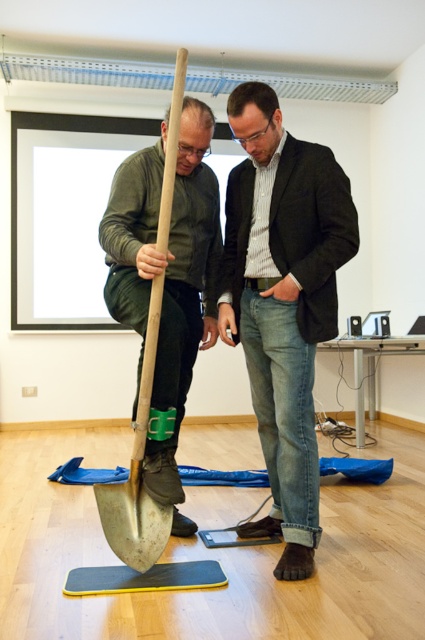
Between denim jeans at center and wooden shovel at left, which one is positioned higher?

wooden shovel at left is higher up.

The width and height of the screenshot is (425, 640). I want to click on denim jeans at center, so click(x=283, y=301).

Identify the location of denim jeans at center. coord(283,301).

Is point (141, 432) less distant than point (152, 572)?

Yes, point (141, 432) is in front of point (152, 572).

Can you confirm if wooden shovel at left is bigger than rubberized yellow mat at lower center?

Yes, wooden shovel at left is bigger than rubberized yellow mat at lower center.

Which is behind, point (158, 317) or point (108, 568)?

The point (108, 568) is behind.

Identify the location of wooden shovel at left. (138, 474).

Measure the distance between denim jeans at center and camera.

A distance of 6.55 feet exists between denim jeans at center and camera.

Which is more to the left, denim jeans at center or rubberized yellow mat at lower center?

From the viewer's perspective, rubberized yellow mat at lower center appears more on the left side.

Between point (325, 300) and point (121, 582), which one is positioned in front?

Point (121, 582) is in front.

You are a GUI agent. You are given a task and a screenshot of the screen. Output one action in this format:
    pyautogui.click(x=<x>, y=<y>)
    Task: Click on the denim jeans at center
    
    Given the screenshot: What is the action you would take?
    pyautogui.click(x=283, y=301)